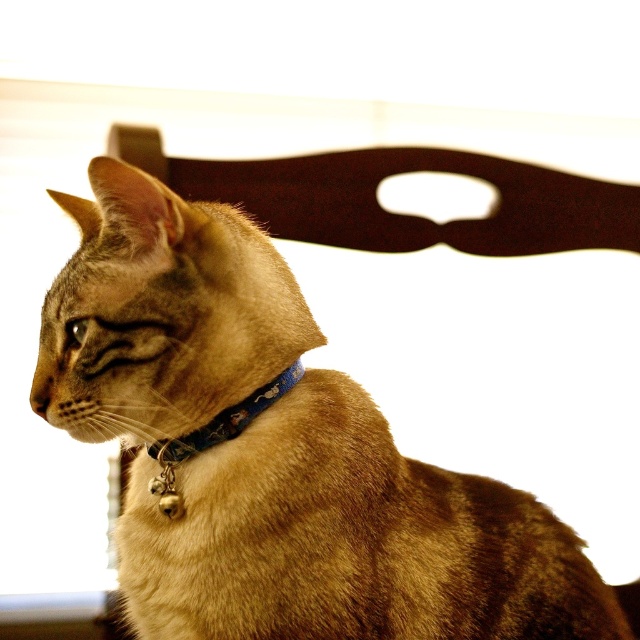
This screenshot has height=640, width=640. What are the coordinates of `brown fur cat at center` in the screenshot? It's located at (273, 451).

Is the position of brown fur cat at center less distant than that of blue fabric neckband at center?

Yes, brown fur cat at center is in front of blue fabric neckband at center.

Where is `brown fur cat at center`? The image size is (640, 640). brown fur cat at center is located at coordinates (273, 451).